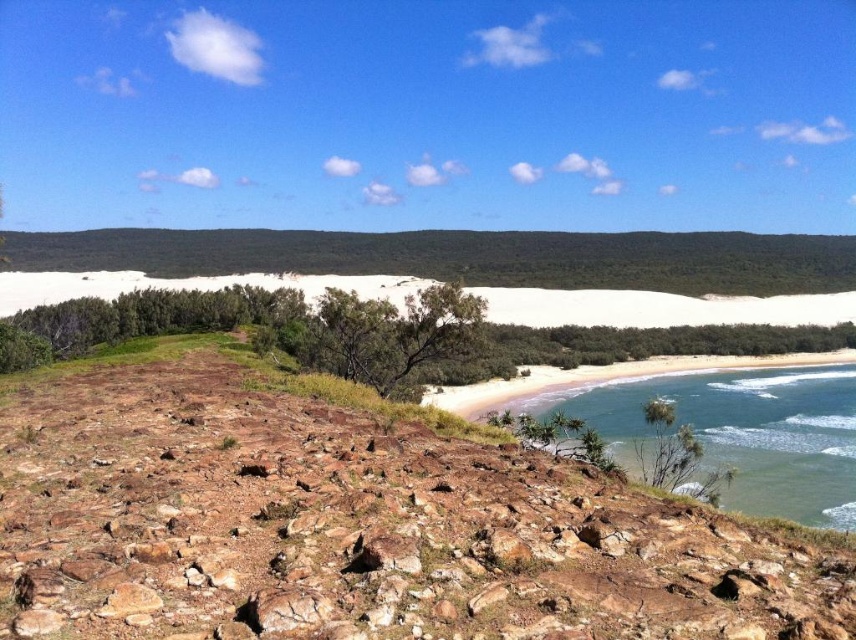
Looking at this image, you are a hiker standing at the base of the green grassy hillside at center and want to reach the smooth sand beach at lower right. Which direction should you move to get there?

Since the green grassy hillside at center is above the smooth sand beach at lower right, you should move downward towards the smooth sand beach at lower right to reach it.

You are standing at the center of the image and want to walk towards the green grassy hillside at center. What direction should you head?

The green grassy hillside at center is located at point coordinates of (462, 257), so you should head towards the center of the image to reach it.